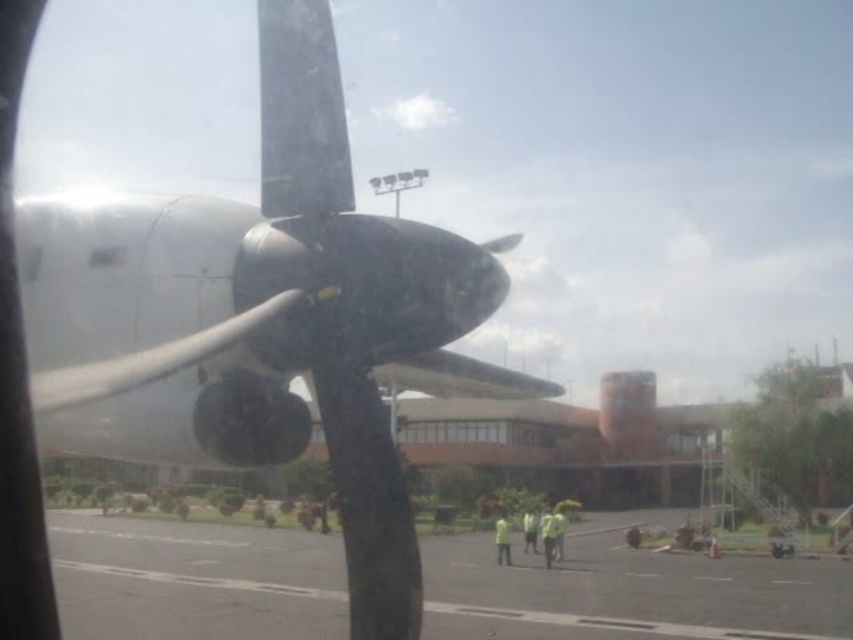
Question: Which object appears closest to the camera in this image?

Choices:
 (A) gray asphalt tarmac at lower center
 (B) polished silver propeller at center

Answer: (B)

Question: Which object is closer to the camera taking this photo?

Choices:
 (A) polished silver propeller at center
 (B) gray asphalt tarmac at lower center

Answer: (A)

Question: From the image, what is the correct spatial relationship of polished silver propeller at center in relation to gray asphalt tarmac at lower center?

Choices:
 (A) left
 (B) right

Answer: (B)

Question: Can you confirm if polished silver propeller at center is positioned to the left of gray asphalt tarmac at lower center?

Choices:
 (A) yes
 (B) no

Answer: (B)

Question: Which point is closer to the camera?

Choices:
 (A) polished silver propeller at center
 (B) gray asphalt tarmac at lower center

Answer: (A)

Question: Is polished silver propeller at center wider than gray asphalt tarmac at lower center?

Choices:
 (A) yes
 (B) no

Answer: (B)